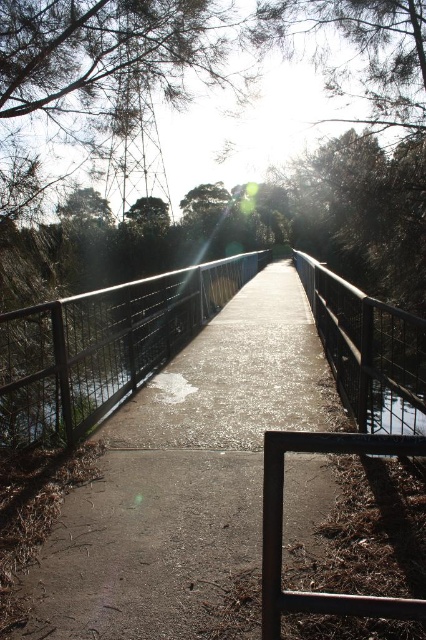
Based on the photo, you are standing on the pedestrian bridge and want to walk from the starting point to the endpoint. The starting point is at point (x=273, y=342) and the endpoint is at point (x=331, y=596). Based on the scene description, which direction should you walk to reach the endpoint?

Since point (x=273, y=342) is behind point (x=331, y=596), you should walk forward towards the endpoint at point (x=331, y=596) from your current position at point (x=273, y=342).

You are standing on the concrete path at center and want to reach the rusty metal balustrade at lower right. Which direction should you move to get there?

You should move to the right because the concrete path at center is to the left of the rusty metal balustrade at lower right, so moving right will bring you towards it.

You are a maintenance worker needing to inspect the rusty metal balustrade at lower right and the concrete path at center. Based on the scene, which object is closer to you as you stand on the bridge?

The concrete path at center is closer to you because the rusty metal balustrade at lower right is positioned behind it.